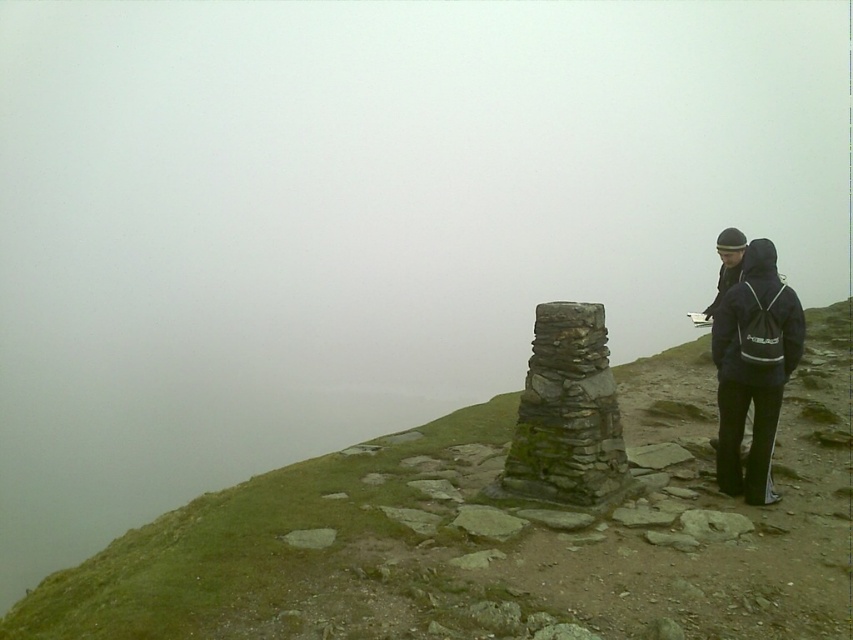
You are hiking on a misty mountain trail and need to locate the dark blue fleece jacket at right. According to the scene, where would you find it relative to the green mossy stone at center?

The dark blue fleece jacket at right is located to the left of the green mossy stone at center.

You are hiking and want to take a photo of both the green mossy stone stack at center and the dark blue fleece jacket at right. Based on their positions, which object should you focus on first to ensure both are in frame?

The green mossy stone stack at center is to the left of dark blue fleece jacket at right, so you should focus on the dark blue fleece jacket at right first to ensure both are in frame.

You are hiking on a misty mountain trail and see the green mossy stone at center and the dark blue fleece jacket at right. Which object is closer to you?

The green mossy stone at center is closer to you because it is positioned in front of the dark blue fleece jacket at right.